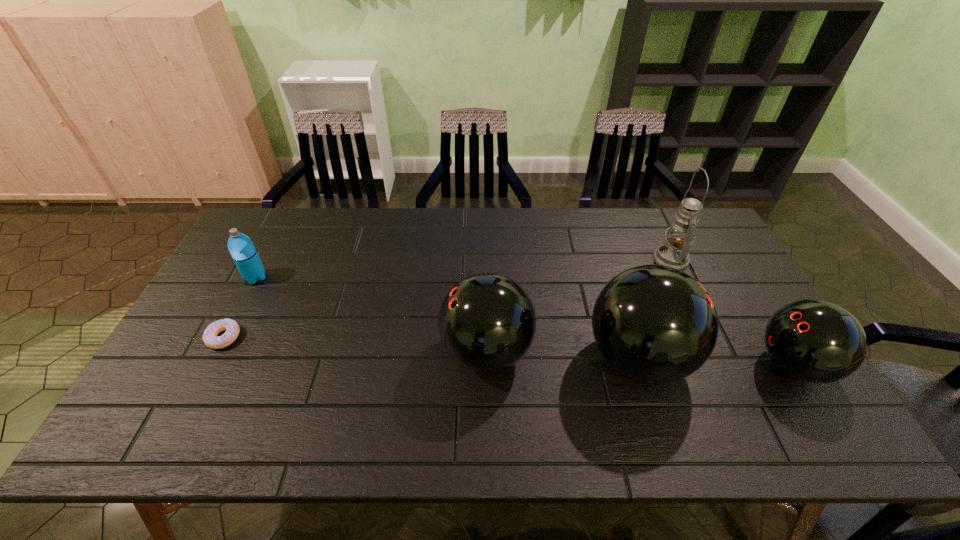
Image resolution: width=960 pixels, height=540 pixels. What are the coordinates of `vacant space located 0.290m on the surface of the third tallest object near the finger holes` in the screenshot? It's located at (331, 352).

You are a GUI agent. You are given a task and a screenshot of the screen. Output one action in this format:
    pyautogui.click(x=<x>, y=<y>)
    Task: Click on the free space located on the surface of the second bowling ball from left to right near the finger holes
    
    Given the screenshot: What is the action you would take?
    pyautogui.click(x=711, y=359)

You are a GUI agent. You are given a task and a screenshot of the screen. Output one action in this format:
    pyautogui.click(x=<x>, y=<y>)
    Task: Click on the vacant area situated 0.260m on the surface of the rightmost bowling ball near the finger holes
    This screenshot has width=960, height=540.
    Given the screenshot: What is the action you would take?
    pyautogui.click(x=652, y=365)

I want to click on vacant region located 0.130m on the surface of the rightmost bowling ball near the finger holes, so click(703, 365).

The width and height of the screenshot is (960, 540). What are the coordinates of `vacant space located 0.400m on the surface of the rightmost bowling ball near the finger holes` in the screenshot? It's located at (597, 365).

Locate an element on the screen. vacant region located on the front of the fifth object from left to right is located at coordinates tap(685, 291).

At what (x,y) coordinates should I click in order to perform the action: click on vacant space situated 0.240m on the back of the thermos bottle. Please return your answer as a coordinate pair (x, y). Image resolution: width=960 pixels, height=540 pixels. Looking at the image, I should click on (284, 224).

In order to click on blank space located on the back of the doughnut in this screenshot , I will do `click(264, 261)`.

Locate an element on the screen. object present at the far edge is located at coordinates (x=674, y=253).

The height and width of the screenshot is (540, 960). I want to click on thermos bottle that is positioned at the left edge, so click(x=241, y=248).